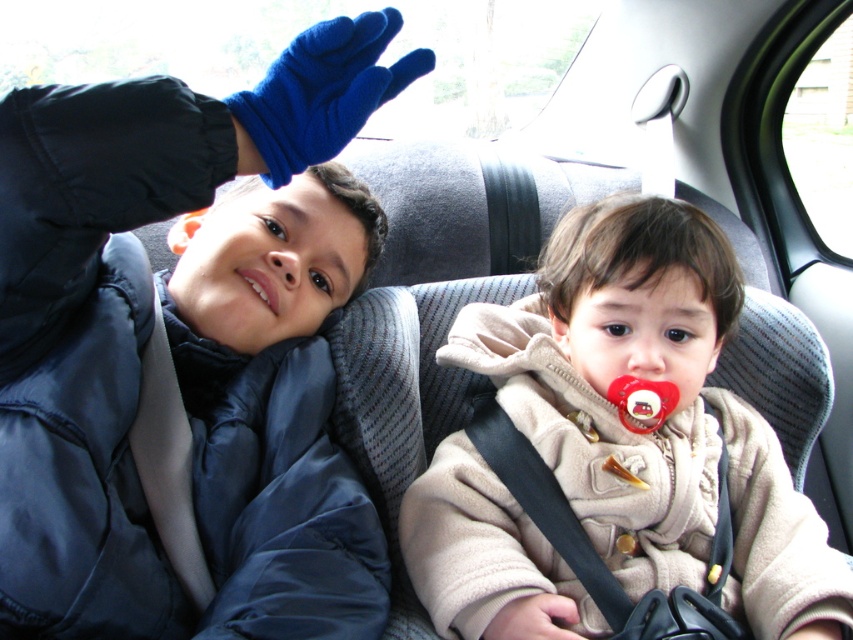
You are a photographer trying to capture a closeup of the smooth skin nose at center. According to the coordinates provided, where exactly should you focus your camera lens?

The smooth skin nose at center is located at coordinates point [648,352], so you should focus your camera lens precisely at that point to capture the closeup.

You are a photographer trying to capture a clear shot of both the matte skin nose at center and the white glossy teeth at center. Since you can only focus on one object at a time, which one should you choose to ensure the other remains somewhat in focus?

You should focus on the matte skin nose at center because it is closer to the viewer than the white glossy teeth at center. By focusing on the closer object, the farther one will still be somewhat in focus due to the depth of field.